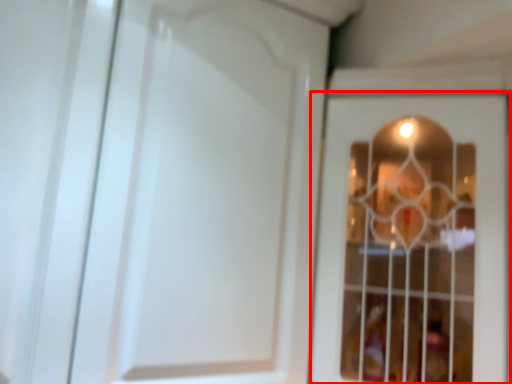
Question: From the image's perspective, where is door (annotated by the red box) located in relation to door in the image?

Choices:
 (A) below
 (B) above

Answer: (A)